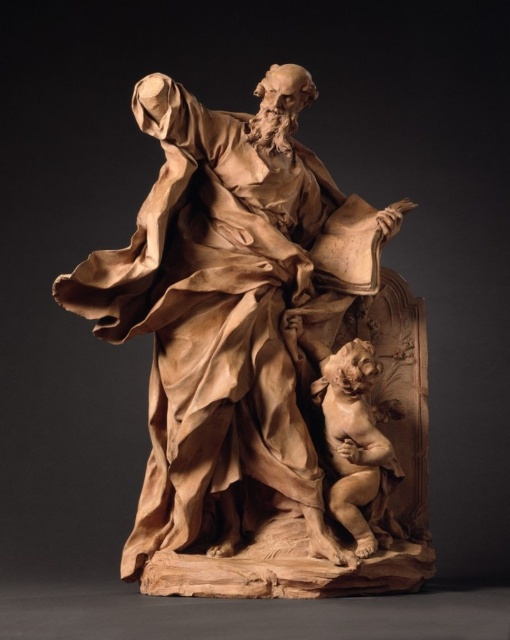
Question: Is wooden statue at center in front of smooth beige cherub at lower right?

Choices:
 (A) yes
 (B) no

Answer: (A)

Question: Which object is closer to the camera taking this photo?

Choices:
 (A) smooth beige cherub at lower right
 (B) wooden statue at center

Answer: (B)

Question: Is wooden statue at center wider than smooth beige cherub at lower right?

Choices:
 (A) yes
 (B) no

Answer: (A)

Question: Which object is closer to the camera taking this photo?

Choices:
 (A) smooth beige cherub at lower right
 (B) wooden statue at center

Answer: (B)

Question: Which of the following is the farthest from the observer?

Choices:
 (A) (326, 397)
 (B) (139, 275)

Answer: (A)

Question: Does wooden statue at center appear under smooth beige cherub at lower right?

Choices:
 (A) no
 (B) yes

Answer: (A)